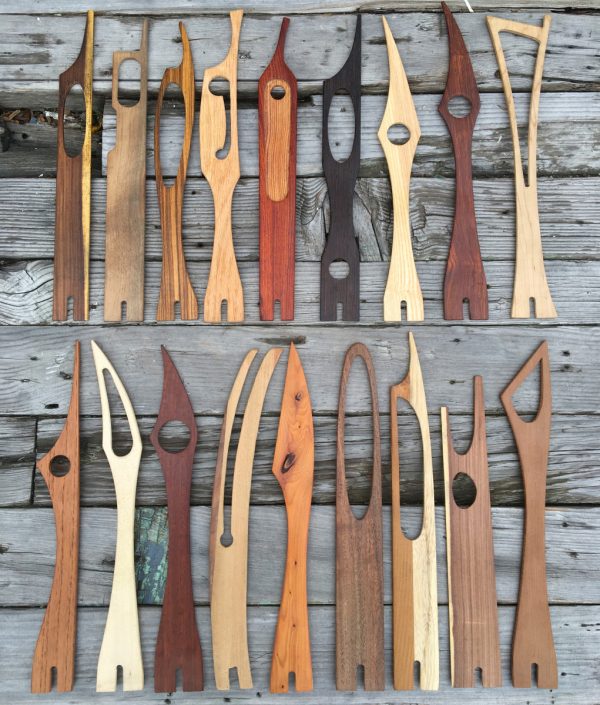
Where is `cream edge on dark wood`? The height and width of the screenshot is (705, 600). cream edge on dark wood is located at coordinates (84, 164).